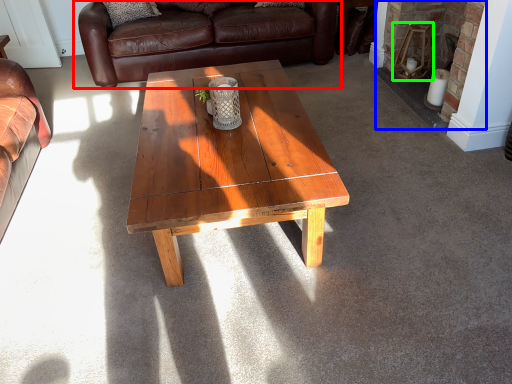
Question: Which object is the closest to the studio couch (highlighted by a red box)? Choose among these: fireplace (highlighted by a blue box) or stool (highlighted by a green box).

Choices:
 (A) fireplace
 (B) stool

Answer: (A)